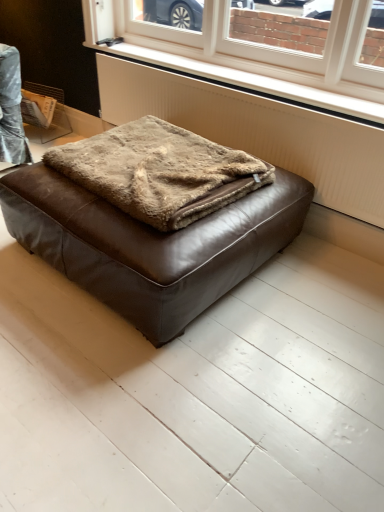
Question: Is brown fuzzy blanket at center positioned before white plastic window at upper center?

Choices:
 (A) yes
 (B) no

Answer: (A)

Question: Does brown fuzzy blanket at center have a lesser height compared to white plastic window at upper center?

Choices:
 (A) yes
 (B) no

Answer: (A)

Question: Is brown fuzzy blanket at center facing towards white plastic window at upper center?

Choices:
 (A) yes
 (B) no

Answer: (B)

Question: Considering the relative sizes of brown fuzzy blanket at center and white plastic window at upper center in the image provided, is brown fuzzy blanket at center taller than white plastic window at upper center?

Choices:
 (A) yes
 (B) no

Answer: (B)

Question: Is brown fuzzy blanket at center to the right of white plastic window at upper center from the viewer's perspective?

Choices:
 (A) no
 (B) yes

Answer: (A)

Question: From a real-world perspective, does brown fuzzy blanket at center stand above white plastic window at upper center?

Choices:
 (A) yes
 (B) no

Answer: (B)

Question: Does white textured radiator at lower center have a smaller size compared to brown leather ottoman at center?

Choices:
 (A) no
 (B) yes

Answer: (B)

Question: Is white textured radiator at lower center facing away from brown leather ottoman at center?

Choices:
 (A) yes
 (B) no

Answer: (B)

Question: Considering the relative positions of white textured radiator at lower center and brown leather ottoman at center in the image provided, is white textured radiator at lower center to the left of brown leather ottoman at center from the viewer's perspective?

Choices:
 (A) yes
 (B) no

Answer: (B)

Question: From the image's perspective, is white textured radiator at lower center beneath brown leather ottoman at center?

Choices:
 (A) yes
 (B) no

Answer: (B)

Question: From a real-world perspective, is white textured radiator at lower center on top of brown leather ottoman at center?

Choices:
 (A) no
 (B) yes

Answer: (B)

Question: Is white textured radiator at lower center further to camera compared to brown leather ottoman at center?

Choices:
 (A) yes
 (B) no

Answer: (A)

Question: From the image's perspective, is brown leather ottoman at center located above white textured radiator at lower center?

Choices:
 (A) no
 (B) yes

Answer: (A)